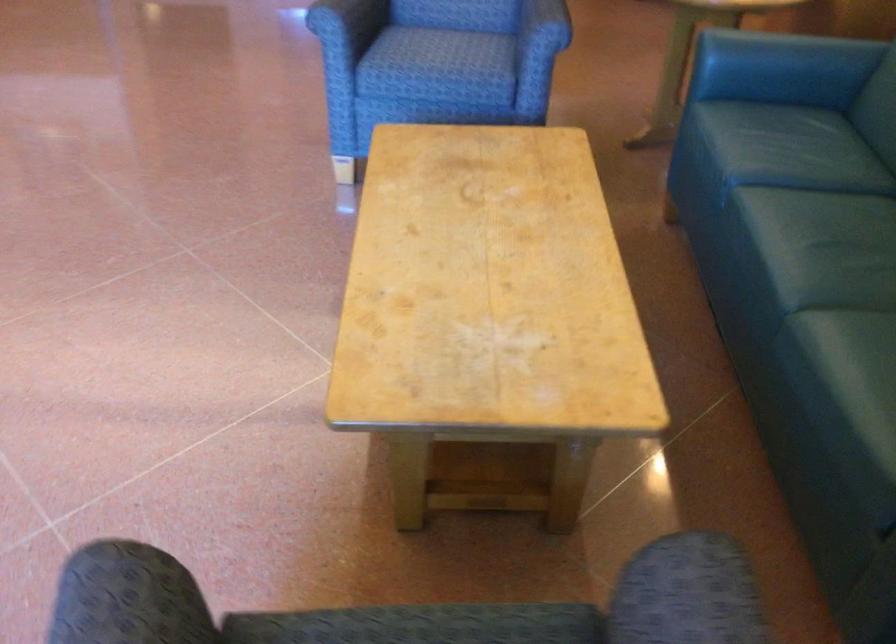
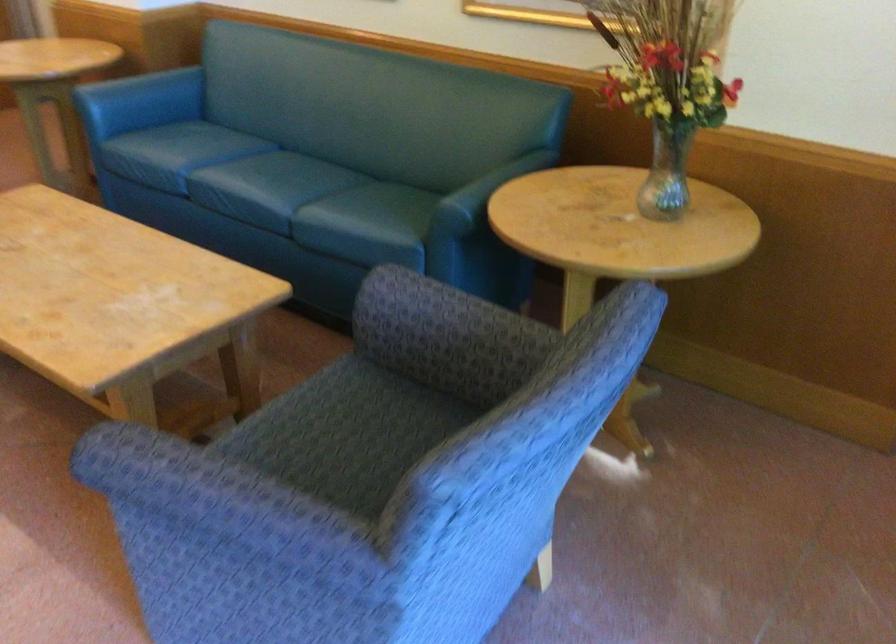
Find the pixel in the second image that matches (797,252) in the first image.

(269, 187)